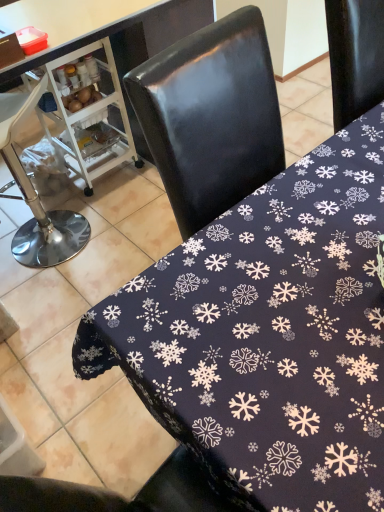
Question: Is dark blue fabric with snowflake pattern at center, the 1th table positioned from the right, bigger or smaller than white plastic cart at left?

Choices:
 (A) big
 (B) small

Answer: (A)

Question: In the image, is dark blue fabric with snowflake pattern at center, the 1th table positioned from the right, positioned in front of or behind white plastic cart at left?

Choices:
 (A) behind
 (B) front

Answer: (B)

Question: Estimate the real-world distances between objects in this image. Which object is farther from the brushed metal bar stool at left?

Choices:
 (A) black fabric tablecloth at center, the second table in the right-to-left sequence
 (B) dark blue fabric with snowflake pattern at center, the 1th table positioned from the right
 (C) white plastic cart at left

Answer: (B)

Question: Which object is the farthest from the dark blue fabric with snowflake pattern at center, the 1th table positioned from the right?

Choices:
 (A) white plastic cart at left
 (B) black fabric tablecloth at center, the first table positioned from the left
 (C) brushed metal bar stool at left

Answer: (A)